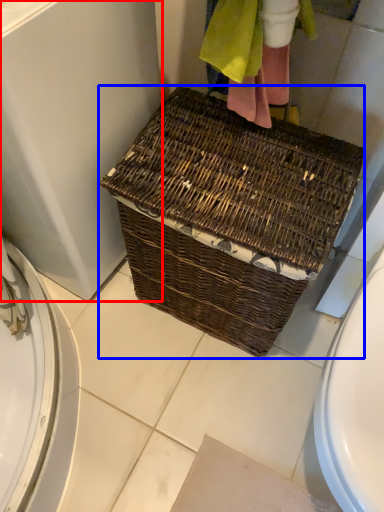
Question: Among these objects, which one is nearest to the camera, screen door (highlighted by a red box) or picnic basket (highlighted by a blue box)?

Choices:
 (A) screen door
 (B) picnic basket

Answer: (A)